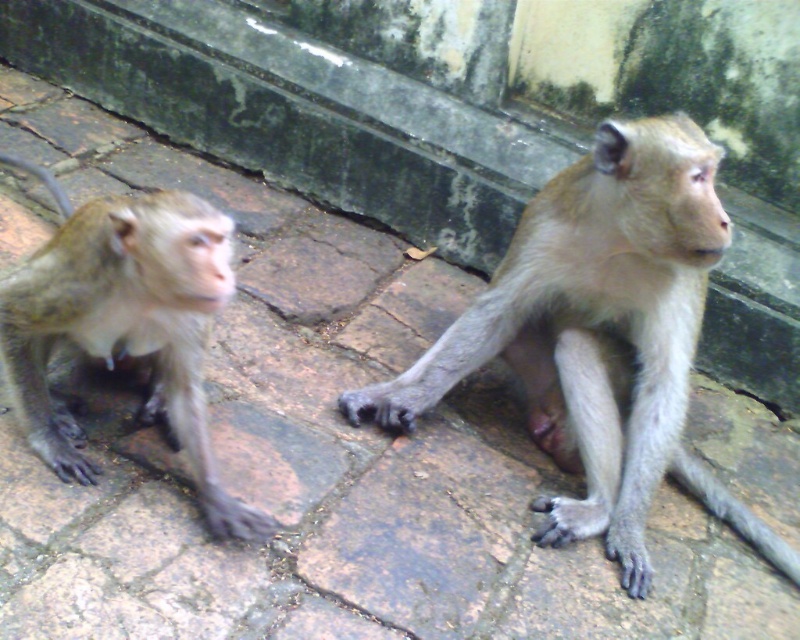
Question: Is light brown fur monkey at center thinner than light brown fur monkey at left?

Choices:
 (A) no
 (B) yes

Answer: (A)

Question: Which of the following is the farthest from the observer?

Choices:
 (A) (608, 378)
 (B) (88, 472)

Answer: (A)

Question: Among these points, which one is farthest from the camera?

Choices:
 (A) (90, 314)
 (B) (664, 300)

Answer: (B)

Question: In this image, where is light brown fur monkey at center located relative to light brown fur monkey at left?

Choices:
 (A) left
 (B) right

Answer: (B)

Question: Is light brown fur monkey at center positioned at the back of light brown fur monkey at left?

Choices:
 (A) no
 (B) yes

Answer: (B)